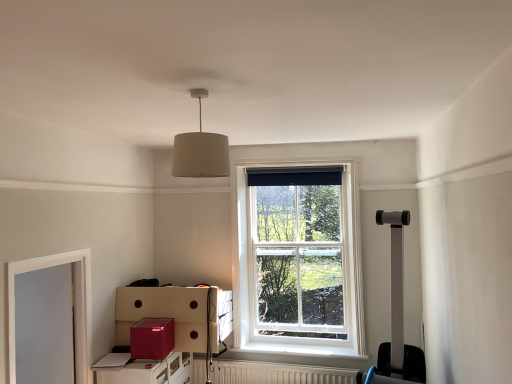
Question: Is beige fabric lampshade at upper center surrounding glossy cardboard box at lower left?

Choices:
 (A) yes
 (B) no

Answer: (B)

Question: Can you confirm if beige fabric lampshade at upper center is taller than glossy cardboard box at lower left?

Choices:
 (A) yes
 (B) no

Answer: (A)

Question: Is beige fabric lampshade at upper center turned away from glossy cardboard box at lower left?

Choices:
 (A) no
 (B) yes

Answer: (A)

Question: Is beige fabric lampshade at upper center positioned beyond the bounds of glossy cardboard box at lower left?

Choices:
 (A) no
 (B) yes

Answer: (B)

Question: From a real-world perspective, is beige fabric lampshade at upper center on top of glossy cardboard box at lower left?

Choices:
 (A) yes
 (B) no

Answer: (A)

Question: Would you consider beige fabric lampshade at upper center to be distant from glossy cardboard box at lower left?

Choices:
 (A) no
 (B) yes

Answer: (B)

Question: Does metallic red file cabinet at lower left lie in front of beige fabric lampshade at upper center?

Choices:
 (A) no
 (B) yes

Answer: (A)

Question: From the image's perspective, is metallic red file cabinet at lower left under beige fabric lampshade at upper center?

Choices:
 (A) no
 (B) yes

Answer: (B)

Question: Is metallic red file cabinet at lower left oriented towards beige fabric lampshade at upper center?

Choices:
 (A) yes
 (B) no

Answer: (B)

Question: Can you confirm if metallic red file cabinet at lower left is smaller than beige fabric lampshade at upper center?

Choices:
 (A) no
 (B) yes

Answer: (A)

Question: Can you confirm if metallic red file cabinet at lower left is bigger than beige fabric lampshade at upper center?

Choices:
 (A) no
 (B) yes

Answer: (B)

Question: Is metallic red file cabinet at lower left facing away from beige fabric lampshade at upper center?

Choices:
 (A) no
 (B) yes

Answer: (A)

Question: Is white wooden window at center smaller than metallic red file cabinet at lower left?

Choices:
 (A) yes
 (B) no

Answer: (A)